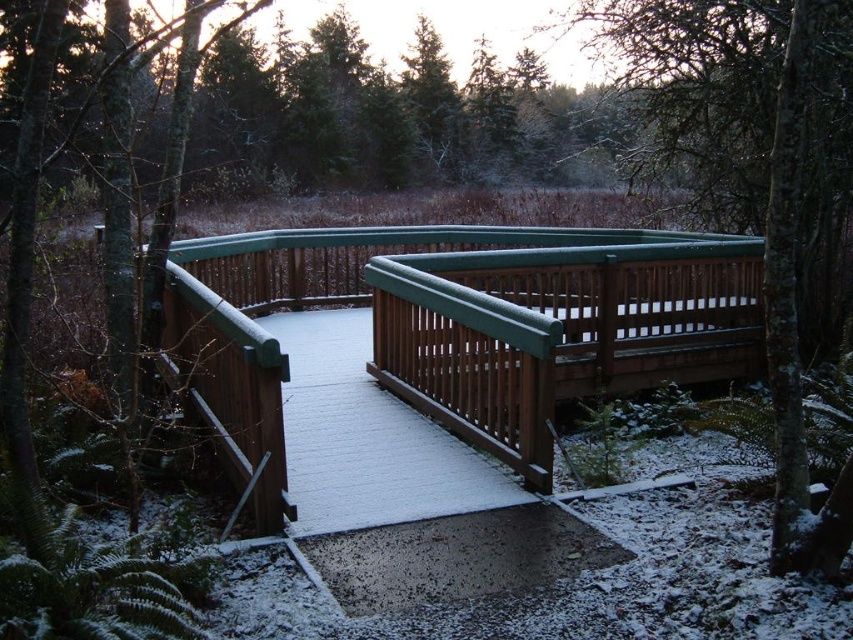
Question: Considering the relative positions of wooden bridge at center and green matte fence at upper center in the image provided, where is wooden bridge at center located with respect to green matte fence at upper center?

Choices:
 (A) right
 (B) left

Answer: (B)

Question: Is wooden bridge at center closer to the viewer compared to green matte fence at upper center?

Choices:
 (A) no
 (B) yes

Answer: (A)

Question: Is wooden bridge at center positioned in front of green matte fence at upper center?

Choices:
 (A) yes
 (B) no

Answer: (B)

Question: Which of the following is the farthest from the observer?

Choices:
 (A) (712, 13)
 (B) (250, 440)

Answer: (A)

Question: Which object appears farthest from the camera in this image?

Choices:
 (A) green matte fence at upper center
 (B) wooden bridge at center

Answer: (B)